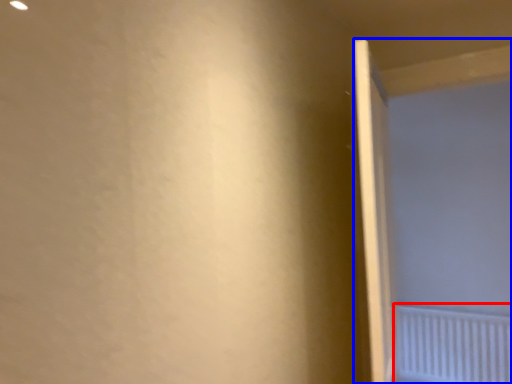
Question: Among these objects, which one is nearest to the camera, radiator (highlighted by a red box) or screen door (highlighted by a blue box)?

Choices:
 (A) radiator
 (B) screen door

Answer: (B)